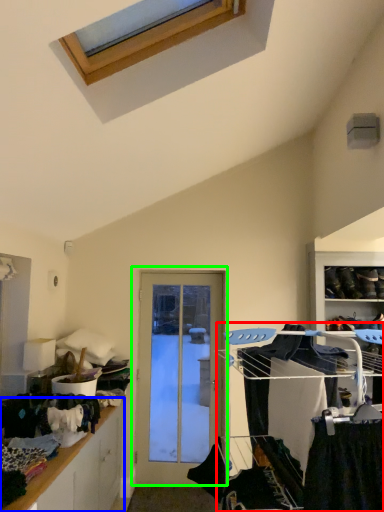
Question: Estimate the real-world distances between objects in this image. Which object is farther from bunk bed (highlighted by a red box), cabinetry (highlighted by a blue box) or door (highlighted by a green box)?

Choices:
 (A) cabinetry
 (B) door

Answer: (B)